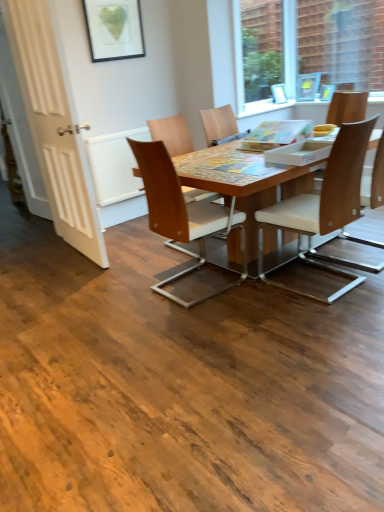
Question: In which direction should I rotate to look at wooden chair at center, the 5th chair positioned from the right?

Choices:
 (A) right
 (B) left

Answer: (A)

Question: From a real-world perspective, is white wooden door at left located beneath transparent glass window at upper right?

Choices:
 (A) no
 (B) yes

Answer: (B)

Question: Is white wooden door at left behind transparent glass window at upper right?

Choices:
 (A) yes
 (B) no

Answer: (B)

Question: From the image's perspective, would you say white wooden door at left is positioned over transparent glass window at upper right?

Choices:
 (A) no
 (B) yes

Answer: (A)

Question: Can you confirm if white wooden door at left is bigger than transparent glass window at upper right?

Choices:
 (A) no
 (B) yes

Answer: (B)

Question: Can you confirm if white wooden door at left is smaller than transparent glass window at upper right?

Choices:
 (A) yes
 (B) no

Answer: (B)

Question: Would you say white wooden door at left is outside transparent glass window at upper right?

Choices:
 (A) no
 (B) yes

Answer: (B)

Question: Considering the relative sizes of transparent glass window at upper right and light brown wood chair at right, acting as the fourth chair starting from the left, in the image provided, is transparent glass window at upper right bigger than light brown wood chair at right, acting as the fourth chair starting from the left,?

Choices:
 (A) no
 (B) yes

Answer: (A)

Question: Considering the relative positions of transparent glass window at upper right and light brown wood chair at right, acting as the fourth chair starting from the left, in the image provided, is transparent glass window at upper right to the left of light brown wood chair at right, acting as the fourth chair starting from the left, from the viewer's perspective?

Choices:
 (A) no
 (B) yes

Answer: (A)

Question: Can you confirm if transparent glass window at upper right is thinner than light brown wood chair at right, acting as the fourth chair starting from the left?

Choices:
 (A) yes
 (B) no

Answer: (A)

Question: Is transparent glass window at upper right to the right of light brown wood chair at right, acting as the fourth chair starting from the left, from the viewer's perspective?

Choices:
 (A) no
 (B) yes

Answer: (B)

Question: Could you tell me if transparent glass window at upper right is facing light brown wood chair at right, the 2th chair in the right-to-left sequence?

Choices:
 (A) no
 (B) yes

Answer: (B)

Question: Does transparent glass window at upper right have a greater width compared to light brown wood chair at right, acting as the fourth chair starting from the left?

Choices:
 (A) yes
 (B) no

Answer: (B)

Question: From a real-world perspective, is light brown wood chair at right, the 2th chair in the right-to-left sequence, over transparent glass window at upper right?

Choices:
 (A) yes
 (B) no

Answer: (B)